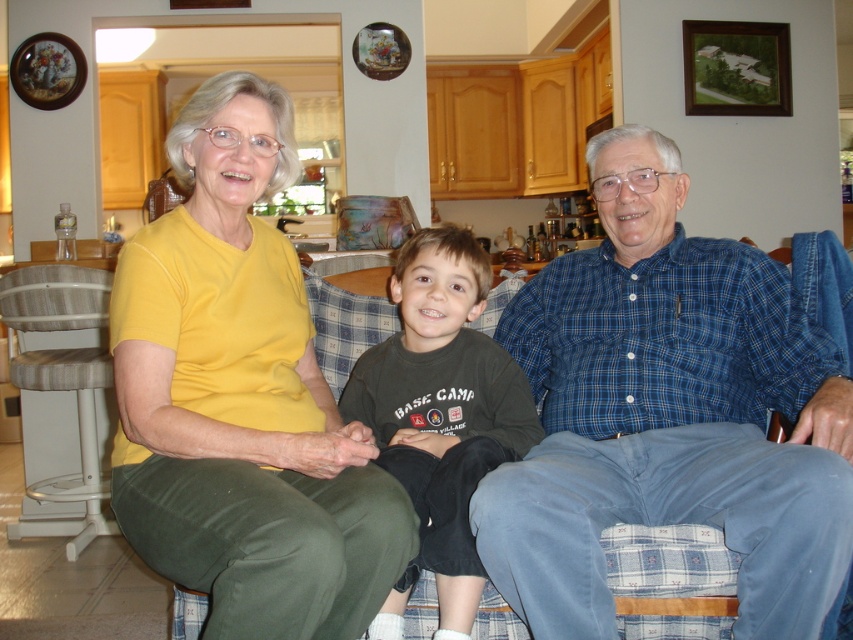
Question: Which object is positioned farthest from the dark gray cotton shirt at center?

Choices:
 (A) wooden textured stool at left
 (B) blue plaid shirt at center
 (C) yellow matte shirt at upper left

Answer: (A)

Question: Is blue plaid shirt at center closer to camera compared to dark gray cotton shirt at center?

Choices:
 (A) yes
 (B) no

Answer: (A)

Question: Observing the image, what is the correct spatial positioning of blue plaid shirt at center in reference to dark gray cotton shirt at center?

Choices:
 (A) left
 (B) right

Answer: (B)

Question: Considering the real-world distances, which object is farthest from the blue plaid shirt at center?

Choices:
 (A) wooden textured stool at left
 (B) yellow matte shirt at upper left

Answer: (A)

Question: Which point appears farthest from the camera in this image?

Choices:
 (A) (16, 324)
 (B) (189, 138)

Answer: (A)

Question: Does yellow matte shirt at upper left appear on the left side of wooden textured stool at left?

Choices:
 (A) yes
 (B) no

Answer: (B)